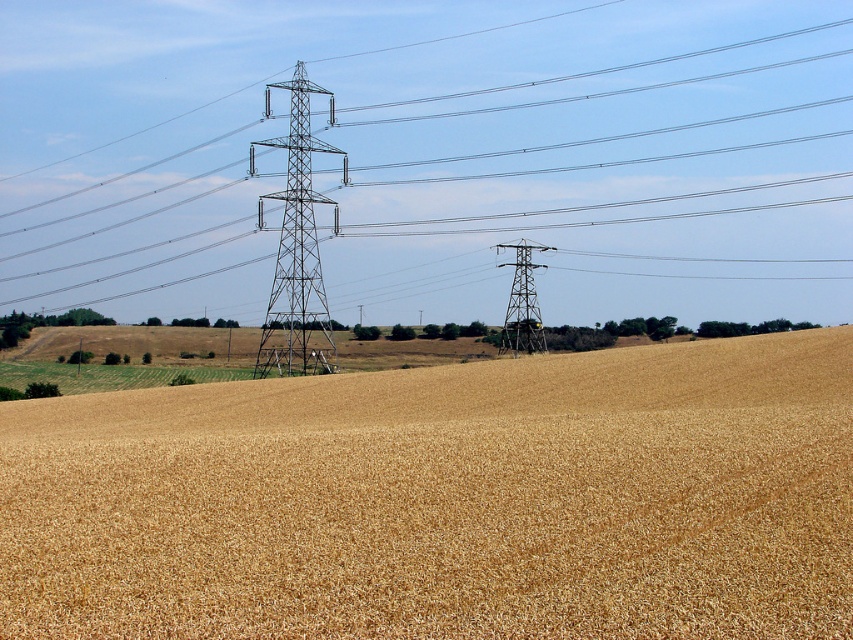
You are a farmer standing in the middle of the wheat field and you see the metallic silver tower at center and the metallic gray tower at center. Which tower is closer to the left side of your view?

The metallic silver tower at center is to the left of the metallic gray tower at center, so the metallic silver tower at center is closer to the left side of your view.

You are a farmer checking the irrigation system. You need to access the metallic silver tower at center to adjust its settings. However, the golden matte wheat field at center is in your way. Can you walk through the wheat field to reach the tower?

The golden matte wheat field at center is in front of the metallic silver tower at center, meaning the tower is behind the wheat field. Therefore, you can walk through the wheat field to reach the metallic silver tower at center.